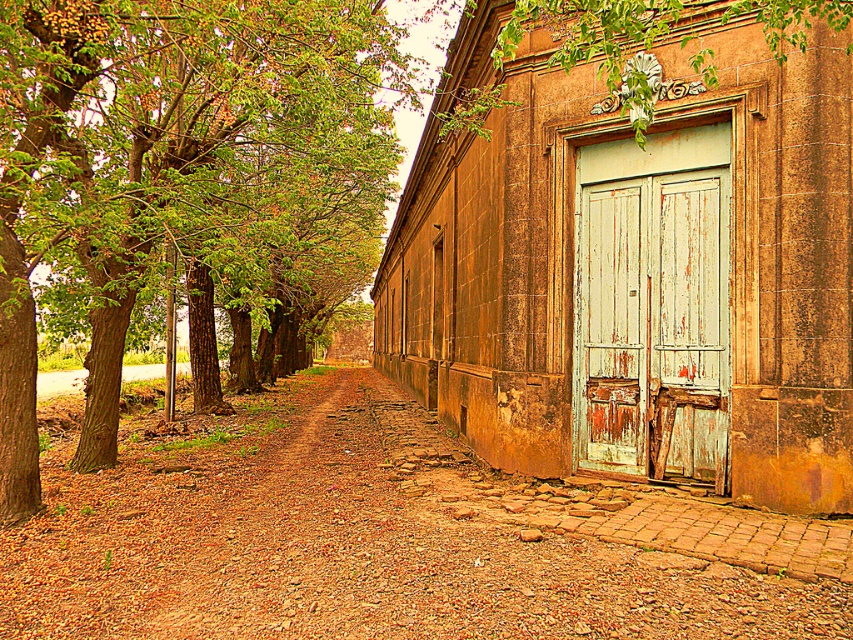
Is green leafy tree at center closer to the viewer compared to peeling white wood door at right?

Yes.

In the scene shown: Who is more distant from viewer, (279, 90) or (610, 209)?

Positioned behind is point (279, 90).

In order to click on green leafy tree at center in this screenshot , I will do `click(178, 168)`.

Can you confirm if brown gravel path at center is positioned above peeling white wood door at right?

No.

Can you confirm if brown gravel path at center is thinner than peeling white wood door at right?

No, brown gravel path at center is not thinner than peeling white wood door at right.

Between point (349, 531) and point (639, 376), which one is positioned in front?

Point (349, 531) is more forward.

Locate an element on the screen. brown gravel path at center is located at coordinates (347, 541).

Looking at this image, measure the distance from brown gravel path at center to green leafy tree at center.

14.99 feet

Is brown gravel path at center further to camera compared to green leafy tree at center?

No, it is in front of green leafy tree at center.

Image resolution: width=853 pixels, height=640 pixels. I want to click on brown gravel path at center, so pyautogui.click(x=347, y=541).